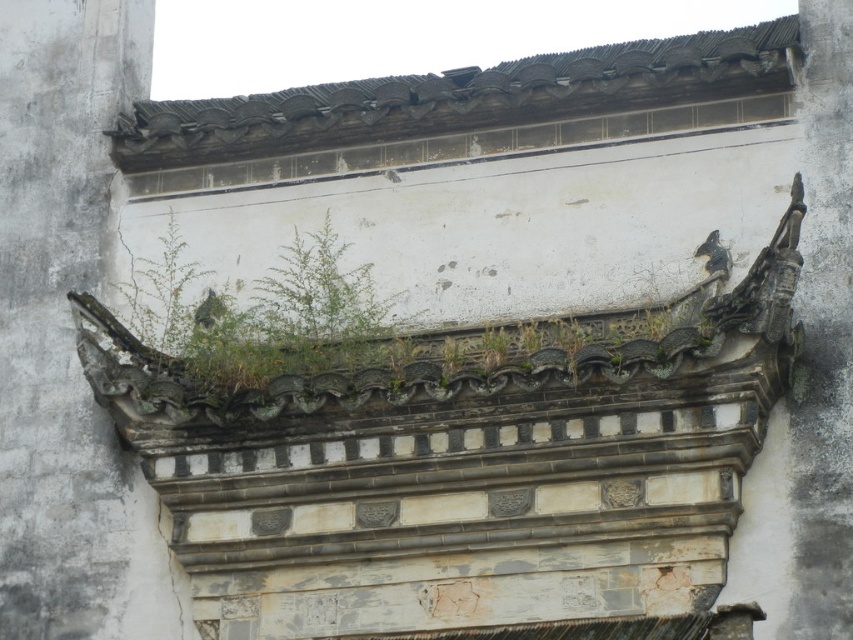
Can you confirm if rusty stone gargoyle at upper center is bigger than green leafy plant at upper left?

Yes, rusty stone gargoyle at upper center is bigger than green leafy plant at upper left.

Does rusty stone gargoyle at upper center appear on the right side of green leafy plant at upper left?

Incorrect, rusty stone gargoyle at upper center is not on the right side of green leafy plant at upper left.

Is point (41, 275) positioned before point (161, 330)?

No, (41, 275) is further to viewer.

This screenshot has width=853, height=640. What are the coordinates of `rusty stone gargoyle at upper center` in the screenshot? It's located at (67, 330).

From the picture: Does dark gray stone dragon at upper right have a smaller size compared to green leafy plant at upper left?

No, dark gray stone dragon at upper right is not smaller than green leafy plant at upper left.

Which is behind, point (836, 432) or point (184, 340)?

The point (184, 340) is more distant.

The height and width of the screenshot is (640, 853). In order to click on dark gray stone dragon at upper right in this screenshot , I will do `click(824, 332)`.

Which of these two, rusty stone gargoyle at upper center or dark gray stone dragon at upper right, stands taller?

rusty stone gargoyle at upper center

The width and height of the screenshot is (853, 640). I want to click on rusty stone gargoyle at upper center, so click(67, 330).